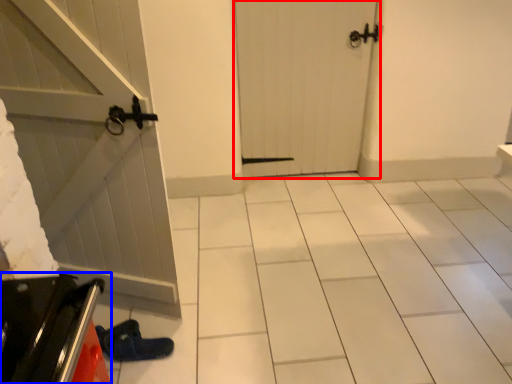
Question: Which of the following is the closest to the observer, door (highlighted by a red box) or appliance (highlighted by a blue box)?

Choices:
 (A) door
 (B) appliance

Answer: (B)